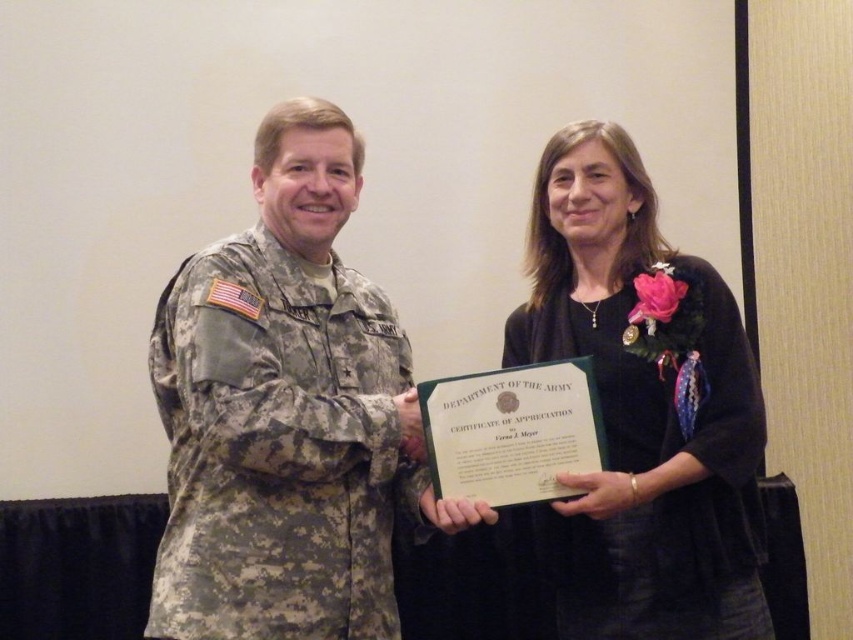
You are a photographer at the event and need to ensure both individuals are visible in the photo. Given that the camouflage uniform at center is taller than the matte black uniform at center, which person should stand closer to the camera to ensure both appear equally tall in the photo?

The matte black uniform at center should stand closer to the camera because the camouflage uniform at center is taller. By positioning the shorter individual closer, their apparent height in the photo will balance with the taller individual standing further back.

You are a photographer at the event and need to ensure both individuals are clearly visible in the photo. Since the camouflage uniform at center and the matte black uniform at center are positioned close to each other, which one should you focus on first to ensure proper depth of field?

The camouflage uniform at center is in front of the matte black uniform at center, so focusing on the camouflage uniform at center first will ensure the foreground subject is sharp, and the background subject may still be in acceptable focus depending on the camera settings.

You are an event photographer at a military award ceremony. You need to capture a photo of both the camouflage uniform at center and the matte black uniform at center. According to the scene, which uniform should you focus on first to ensure both are in frame?

The camouflage uniform at center is to the left of the matte black uniform at center, so you should focus on the matte black uniform at center first to ensure both are in frame.